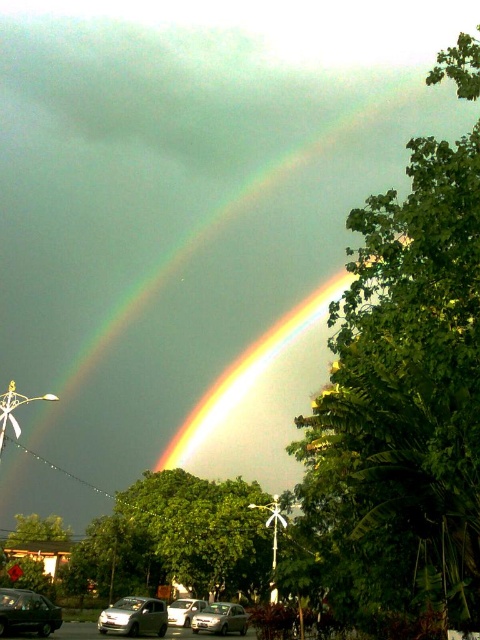
You are a photographer trying to capture the rainbow in the scene. You notice two cars, the silver metallic car at lower left and the satin silver car at lower center. Which car should you avoid positioning in front of the rainbow to ensure it doesn t block the view? Explain your choice based on their sizes.

You should avoid positioning the satin silver car at lower center in front of the rainbow because it is taller than the silver metallic car at lower left. The taller satin silver car would block more of the rainbow view compared to the shorter silver metallic car.

You are a pedestrian standing on the street and looking at the silver metallic car at lower left and the satin silver car at lower center. Which car is positioned higher in the image?

The silver metallic car at lower left is positioned higher than the satin silver car at lower center in the image.

You are a delivery drone that needs to fly between the silver metallic car at lower left and the silver metallic car at center. The drone has a wingspan of 1.5 meters. Can it safely pass through the gap between them without touching either car?

The distance between the silver metallic car at lower left and the silver metallic car at center is 7.23 meters. Since the drone has a wingspan of 1.5 meters, it can safely pass through the gap as the distance is much wider than the drone.